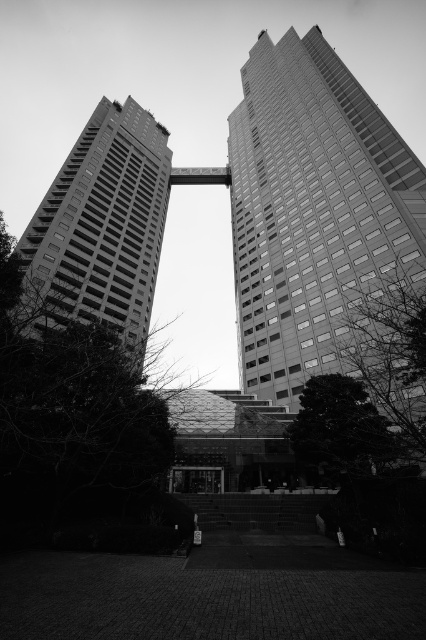
Question: Is smooth glass skyscraper at center positioned in front of smooth concrete building at left?

Choices:
 (A) yes
 (B) no

Answer: (B)

Question: Can you confirm if smooth glass skyscraper at center is positioned below smooth concrete building at left?

Choices:
 (A) no
 (B) yes

Answer: (A)

Question: Which of the following is the closest to the observer?

Choices:
 (A) (94, 241)
 (B) (242, 308)

Answer: (B)

Question: Among these objects, which one is farthest from the camera?

Choices:
 (A) smooth glass skyscraper at center
 (B) smooth concrete building at left

Answer: (A)

Question: Does smooth glass skyscraper at center have a lesser width compared to smooth concrete building at left?

Choices:
 (A) yes
 (B) no

Answer: (B)